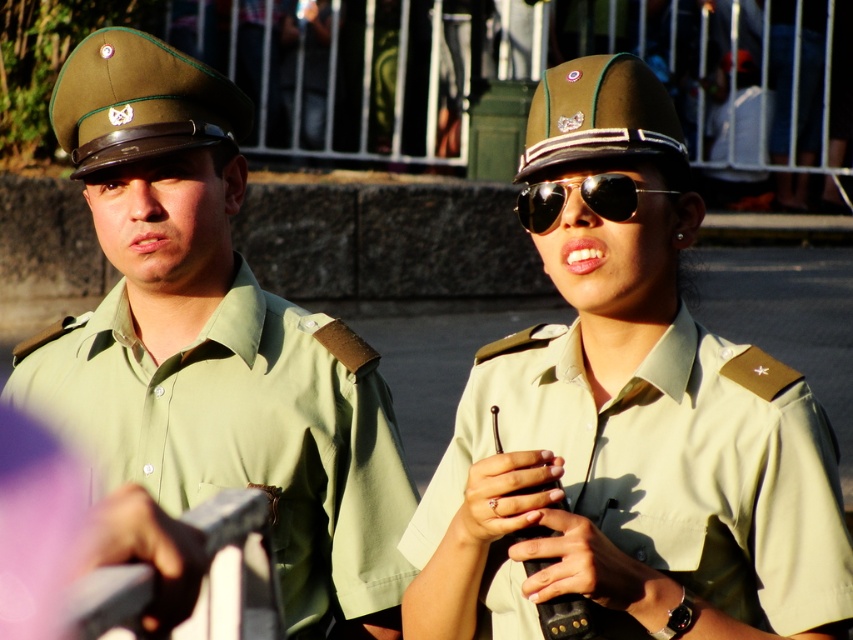
You are a photographer at the event and need to capture a photo where both the khaki fabric uniform at right and the gold reflective sunglasses at center are clearly visible. Given their height difference, which object should you position closer to the camera to ensure both are in focus?

The khaki fabric uniform at right is taller than the gold reflective sunglasses at center, so positioning the khaki fabric uniform at right closer to the camera will help ensure both are in focus.

You are a photographer trying to capture a candid shot of the khaki fabric uniform at right and the gold reflective sunglasses at center. If your camera has a minimum focusing distance of 80 centimeters, will you be able to take the photo without moving closer?

The distance between the khaki fabric uniform at right and the gold reflective sunglasses at center is 77.85 centimeters, which is less than the camera minimum focusing distance of 80 centimeters. Therefore, you cannot take the photo without moving closer.